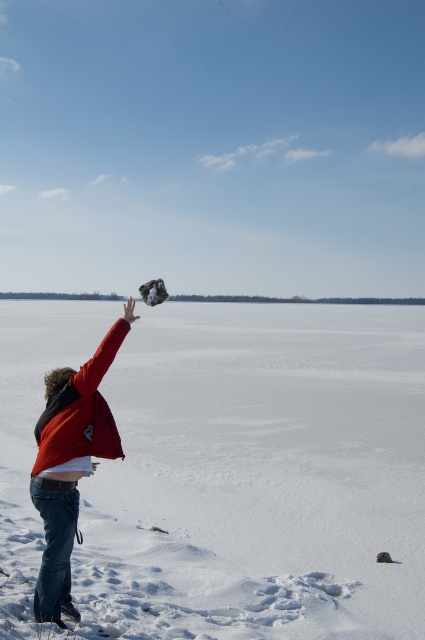
Is point (206, 637) closer to camera compared to point (68, 492)?

No, (206, 637) is further to viewer.

Which is below, white fluffy snow at upper center or red cotton jacket at center?

white fluffy snow at upper center

What are the coordinates of `white fluffy snow at upper center` in the screenshot? It's located at (258, 477).